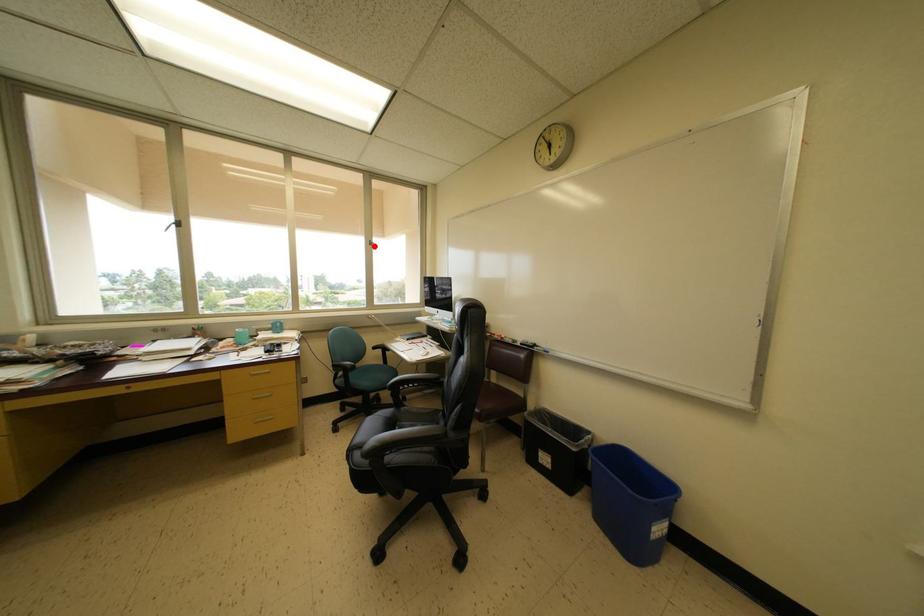
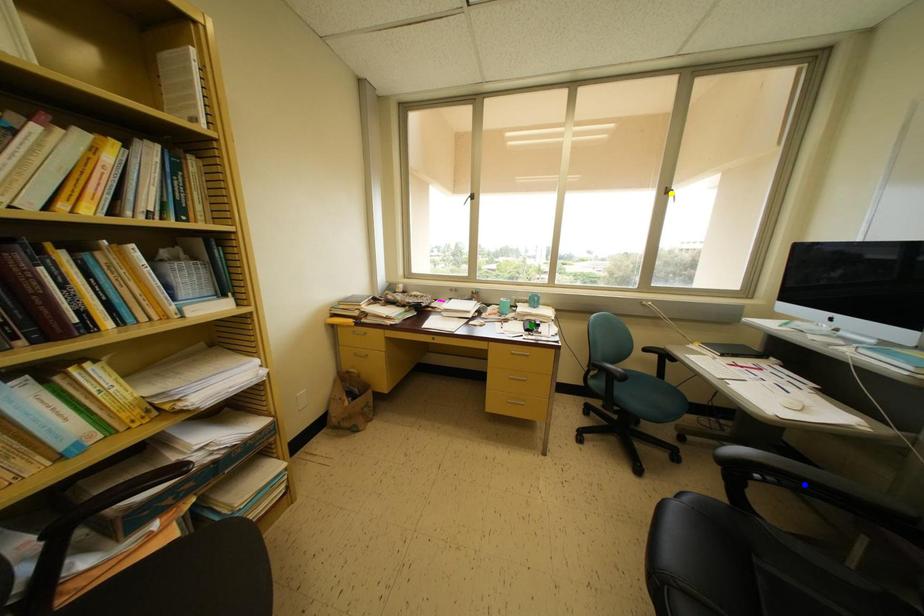
Question: I am providing you with two images of the same scene from different viewpoints. A red point is marked on the first image. You are given multiple points on the second image. In image 2, which mark is for the same physical point as the one in image 1?

Choices:
 (A) yellow point
 (B) blue point
 (C) green point

Answer: (A)